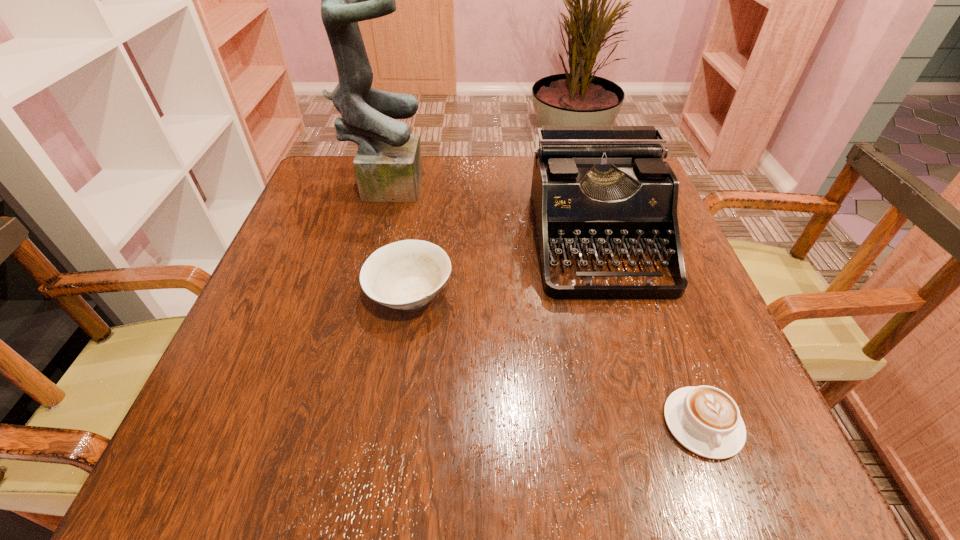
I want to click on vacant space at the right edge of the desktop, so click(651, 403).

This screenshot has width=960, height=540. I want to click on free space at the far left corner, so click(x=344, y=190).

Image resolution: width=960 pixels, height=540 pixels. In order to click on blank region between the typewriter and the shortest object in this screenshot , I will do `click(649, 332)`.

Find the location of a particular element. Image resolution: width=960 pixels, height=540 pixels. vacant area that lies between the tallest object and the typewriter is located at coordinates (491, 211).

I want to click on free space between the bowl and the typewriter, so click(x=503, y=267).

This screenshot has height=540, width=960. Identify the location of empty location between the typewriter and the bowl. (503, 267).

At what (x,y) coordinates should I click in order to perform the action: click on vacant area that lies between the third shortest object and the tallest object. Please return your answer as a coordinate pair (x, y). Image resolution: width=960 pixels, height=540 pixels. Looking at the image, I should click on (491, 211).

At what (x,y) coordinates should I click in order to perform the action: click on empty space that is in between the nearest object and the third shortest object. Please return your answer as a coordinate pair (x, y). Looking at the image, I should click on (649, 332).

The image size is (960, 540). In order to click on vacant space that's between the typewriter and the sculpture in this screenshot , I will do `click(491, 211)`.

This screenshot has height=540, width=960. Find the location of `unoccupied area between the third tallest object and the tallest object`. unoccupied area between the third tallest object and the tallest object is located at coordinates (397, 238).